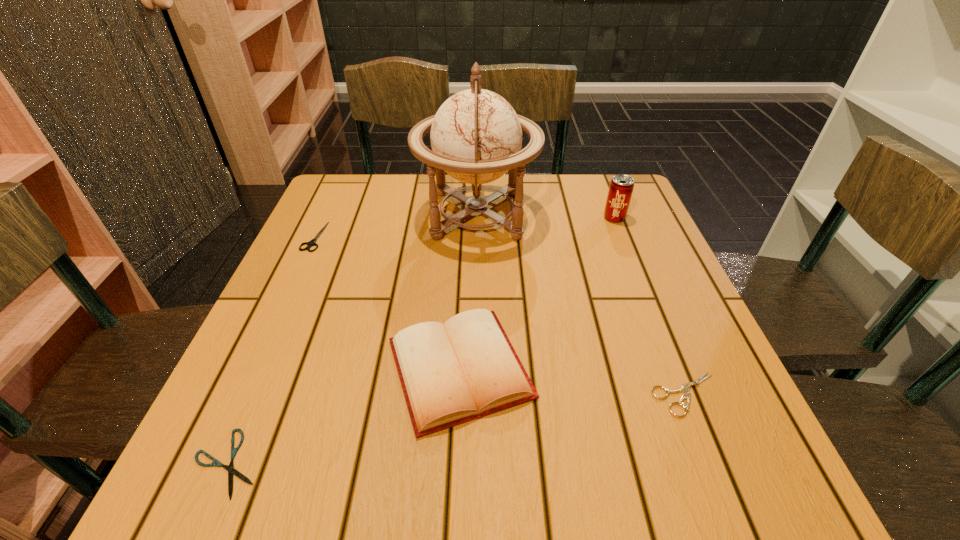
Where is `free space between the second nearest shears and the shortest shears`? The image size is (960, 540). free space between the second nearest shears and the shortest shears is located at coordinates (457, 429).

Locate an element on the screen. empty location between the third shortest object and the globe is located at coordinates (396, 226).

The image size is (960, 540). Find the location of `unoccupied area between the shortest shears and the globe`. unoccupied area between the shortest shears and the globe is located at coordinates (352, 339).

In order to click on vacant area that lies between the shortest shears and the tallest object in this screenshot , I will do `click(352, 339)`.

At what (x,y) coordinates should I click in order to perform the action: click on vacant area that lies between the Bible and the third shortest object. Please return your answer as a coordinate pair (x, y). This screenshot has height=540, width=960. Looking at the image, I should click on (387, 302).

You are a GUI agent. You are given a task and a screenshot of the screen. Output one action in this format:
    pyautogui.click(x=<x>, y=<y>)
    Task: Click on the free area in between the globe and the second farthest shears
    The height and width of the screenshot is (540, 960).
    Given the screenshot: What is the action you would take?
    pyautogui.click(x=582, y=305)

Where is `blank region between the shortest object and the second shortest object`? The width and height of the screenshot is (960, 540). blank region between the shortest object and the second shortest object is located at coordinates (457, 429).

The image size is (960, 540). What are the coordinates of `vacant area between the beer can and the Bible` in the screenshot? It's located at (537, 293).

This screenshot has width=960, height=540. What are the coordinates of `blank region between the globe and the shortest shears` in the screenshot? It's located at (352, 339).

Identify the location of object that stands as the fourth closest to the tallest object. The width and height of the screenshot is (960, 540). (685, 388).